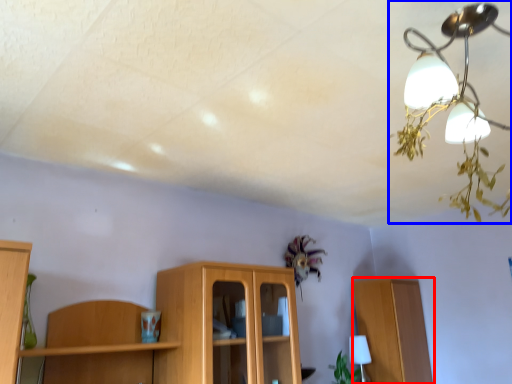
Question: Which object is further to the camera taking this photo, cabinetry (highlighted by a red box) or lamp (highlighted by a blue box)?

Choices:
 (A) cabinetry
 (B) lamp

Answer: (A)